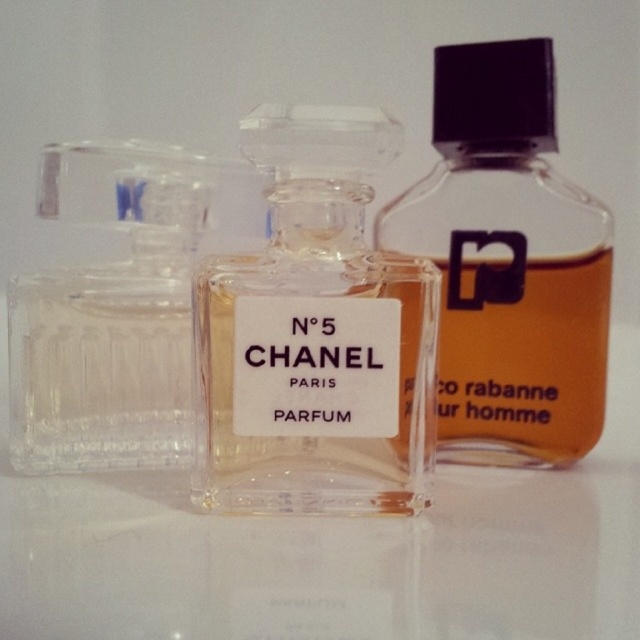
You are a store manager arranging perfume bottles on a shelf. You have a clear glass bottle at center and a transparent glass bottle at center. Which one has a smaller width?

The clear glass bottle at center has a lesser width compared to the transparent glass bottle at center, so it is smaller in width.

You are a store manager arranging perfume bottles on a shelf. You have a shelf space that can only accommodate items up to the width of the transparent glass perfume at left. You want to place the transparent glass bottle at center on this shelf. Can it fit based on their widths?

The transparent glass bottle at center is wider than the transparent glass perfume at left, so it cannot fit within the shelf space allocated for the transparent glass perfume at left.

You are a store manager arranging perfume bottles on a shelf. You have a clear glass bottle at center and a transparent glass perfume at left. Which bottle requires more horizontal space on the shelf?

The clear glass bottle at center requires more horizontal space on the shelf because its width surpasses that of the transparent glass perfume at left.